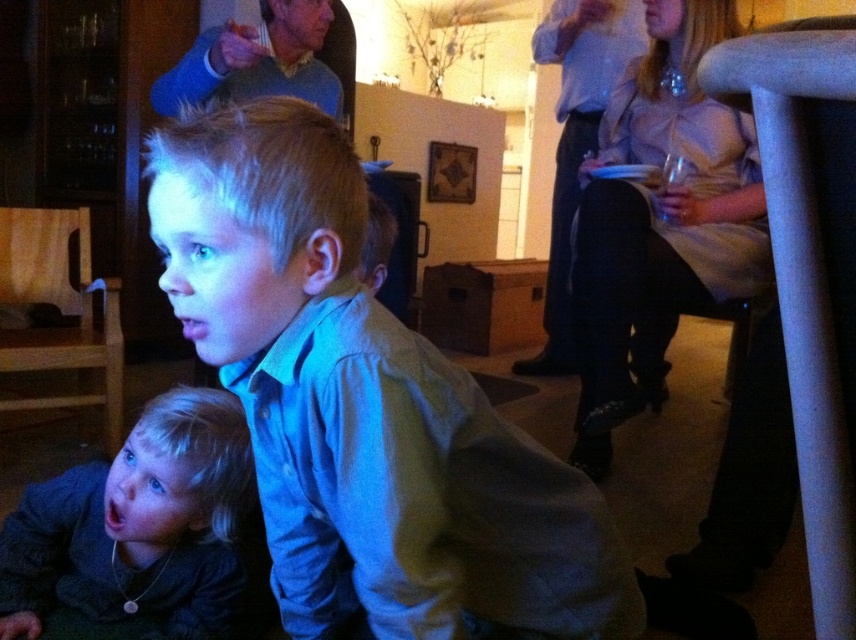
Between matte blue shirt at center and dark gray sweater at lower left, which one is positioned lower?

dark gray sweater at lower left is lower down.

Which is behind, point (272, 426) or point (158, 548)?

The point (158, 548) is behind.

The height and width of the screenshot is (640, 856). What are the coordinates of `matte blue shirt at center` in the screenshot? It's located at (363, 403).

Can you confirm if matte blue shirt at center is bigger than light blue shirt at upper right?

Incorrect, matte blue shirt at center is not larger than light blue shirt at upper right.

Which of these two, matte blue shirt at center or light blue shirt at upper right, stands shorter?

Standing shorter between the two is matte blue shirt at center.

Which is behind, point (602, 625) or point (563, 61)?

The point (563, 61) is behind.

What are the coordinates of `matte blue shirt at center` in the screenshot? It's located at (363, 403).

Is silky beige dress at upper right shorter than dark gray sweater at lower left?

No, silky beige dress at upper right is not shorter than dark gray sweater at lower left.

Does silky beige dress at upper right have a lesser width compared to dark gray sweater at lower left?

Incorrect, silky beige dress at upper right's width is not less than dark gray sweater at lower left's.

From the picture: Who is more forward, (580, 205) or (88, 557)?

Positioned in front is point (88, 557).

At what (x,y) coordinates should I click in order to perform the action: click on silky beige dress at upper right. Please return your answer as a coordinate pair (x, y). The width and height of the screenshot is (856, 640). Looking at the image, I should click on (660, 221).